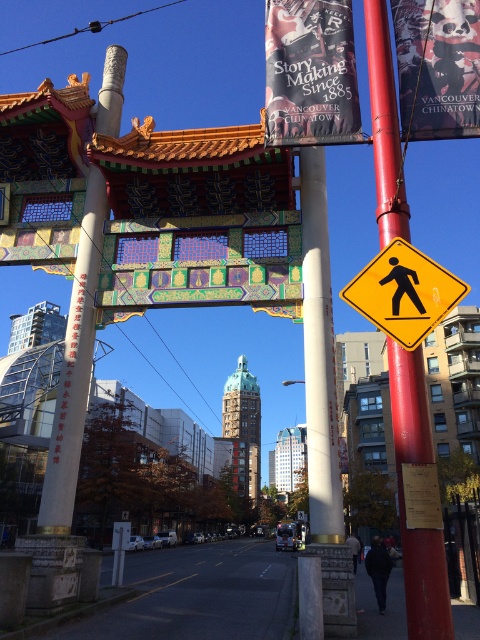
You are a visitor standing in front of the archway and want to take a photo that includes both the black fabric banner at upper center and the matte paper poster at upper right. Which object should you adjust your camera angle to focus on first to ensure both are in frame?

The black fabric banner at upper center is not as tall as the matte paper poster at upper right, so you should focus on the matte paper poster at upper right first to ensure both are captured in the frame.

You are standing in front of the traditional Chinese archway in Vancouver Chinatown. There is a point marked at coordinates point (404, 500). Can you tell me what object this point is located on?

The point (404, 500) is located on the smooth red pole at right.